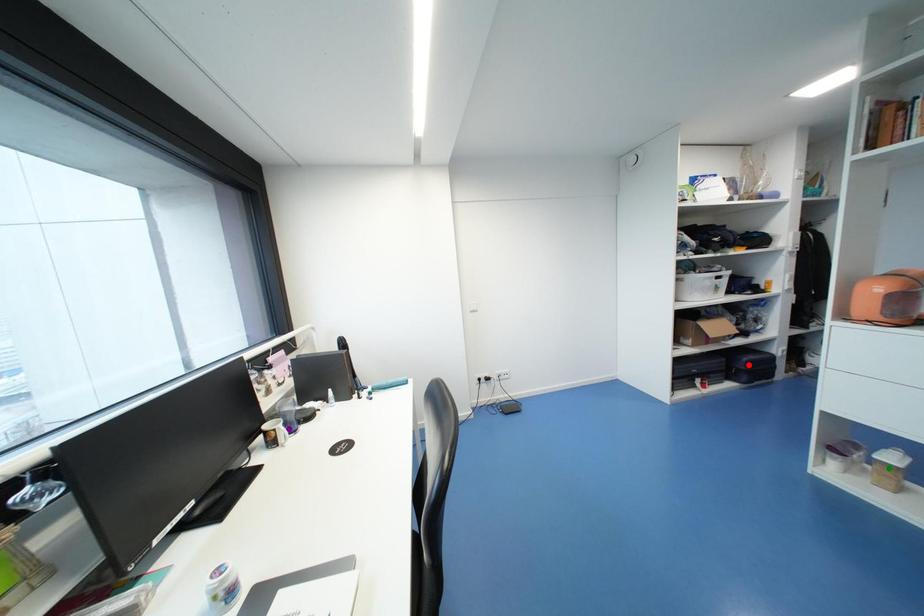
Order these from nearest to farthest:
- purple point
- red point
- green point

red point < purple point < green point